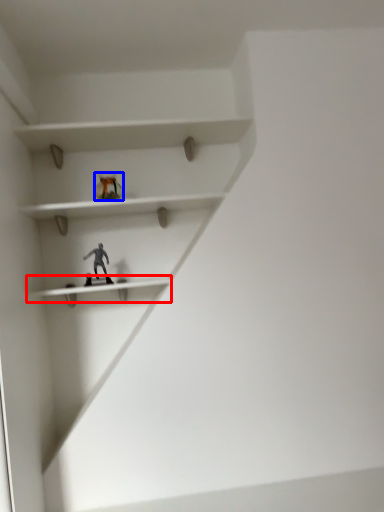
Question: Among these objects, which one is nearest to the camera, shelf (highlighted by a red box) or toy (highlighted by a blue box)?

Choices:
 (A) shelf
 (B) toy

Answer: (A)